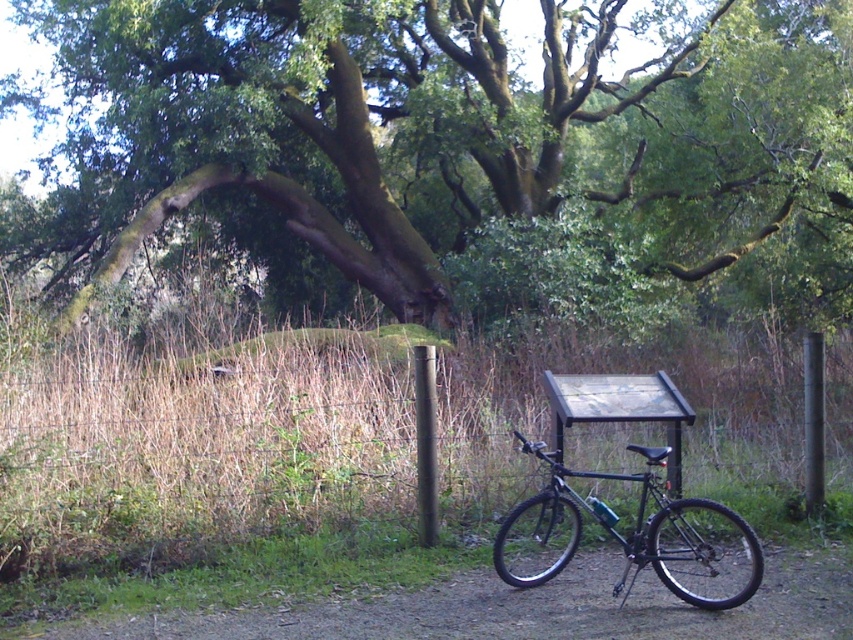
You are a hiker who just arrived at the scene. You need to park your backpack next to the black metallic bicycle at lower right and the smooth gray pole at right. The backpack is 1.5 meters long. Can you place it between them without overlapping either object?

The distance between the black metallic bicycle at lower right and the smooth gray pole at right is 2.03 meters. Since the backpack is 1.5 meters long, there is enough space to place it between them without overlapping either object.

You are planning to walk along the dirt path at center. Considering the presence of the black metallic bicycle at lower right, will the path be wide enough for you to pass by the bicycle without stepping off the path?

The dirt path at center is smaller than the black metallic bicycle at lower right, so it may not be wide enough for you to pass by the bicycle without stepping off the path.

You are planning to walk along the dirt path at center while avoiding the smooth gray pole at right. Considering their sizes, which one allows more space for you to walk through?

The dirt path at center has a larger width than the smooth gray pole at right, so it allows more space for walking through.